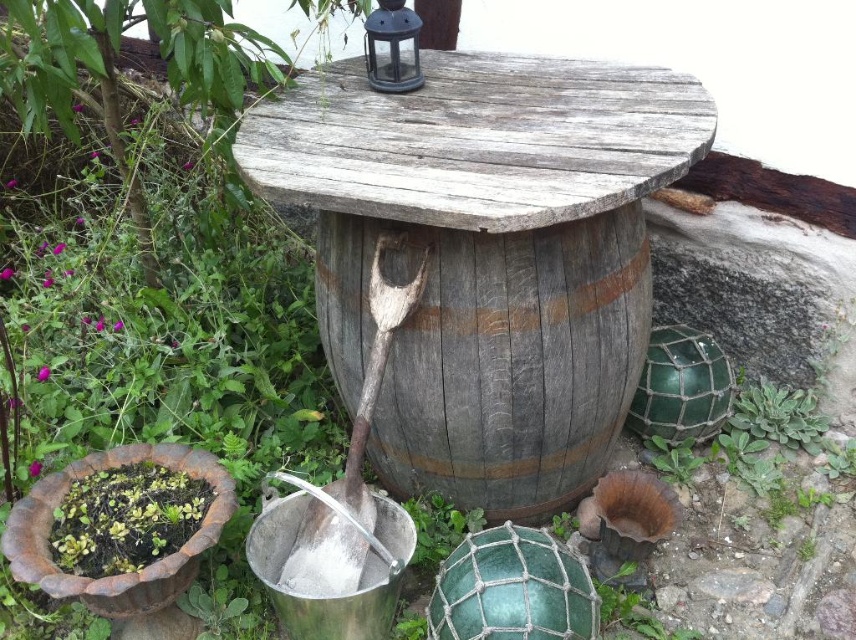
You are standing at the center of the image. Where is the weathered wood barrel at center located relative to your position?

The weathered wood barrel at center is located at point (492, 353) relative to the center of the image.

You are standing in front of the rustic outdoor setting with the repurposed wooden barrel. There are two points marked on the barrel. Which point, point 1 at coordinates (354,339) or point 2 at coordinates (405,292), is closer to you?

Point 1 at coordinates (354,339) is closer to you because it is further to the viewer than point 2 at coordinates (405,292).

You are setting up a garden display and need to place a decorative item on top of the weathered wood barrel at center. However, you also want to ensure the wooden shovel at center remains visible. Given their sizes, can you place the item on the barrel without blocking the shovel?

The weathered wood barrel at center is much taller than the wooden shovel at center. Since the barrel is taller, placing a decorative item on top of it would not block the view of the shovel, as the shovel is shorter and positioned near the barrel.